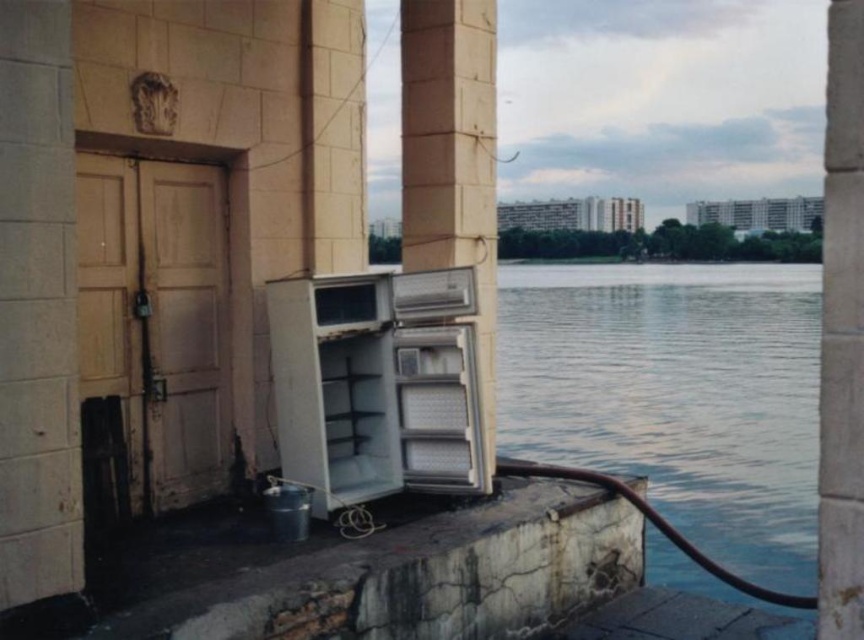
Consider the image. You are a delivery person who needs to load a white plastic refrigerator at lower left and a white plastic refrigerator at center into your truck. The truck has a height restriction of 6 feet. If the taller refrigerator is 5.8 feet tall, will both refrigerators fit inside the truck?

The white plastic refrigerator at lower left is not as tall as the white plastic refrigerator at center, which is 5.8 feet tall. Since the truck has a 6 feet height restriction, both refrigerators will fit inside the truck.

You are standing at the point marked with coordinates point (376, 385). Looking around, you see a white plastic refrigerator at lower left and a closed wooden door with a padlock attached to it. Which object is closer to your current position?

The point (376, 385) is on white plastic refrigerator at lower left, so the white plastic refrigerator at lower left is closer to your current position.